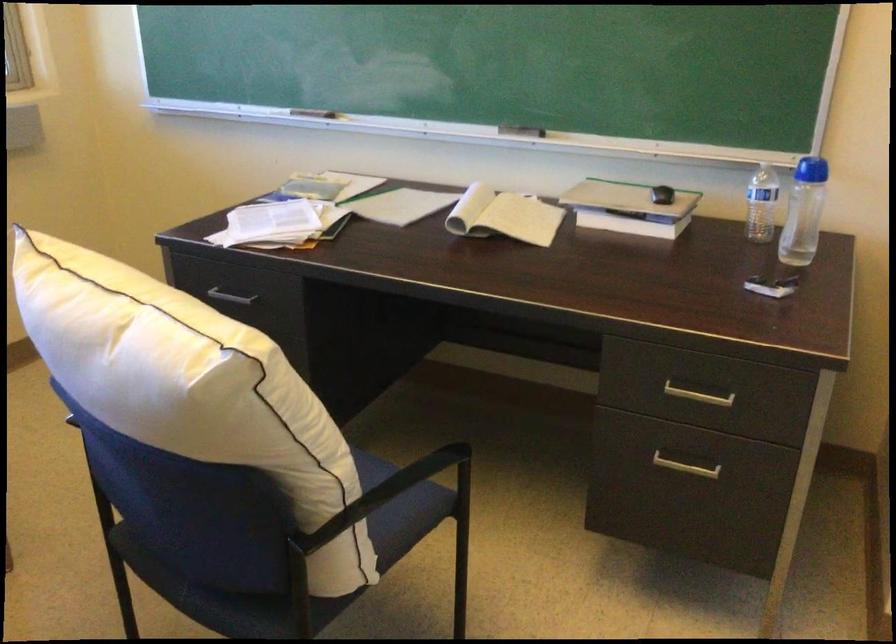
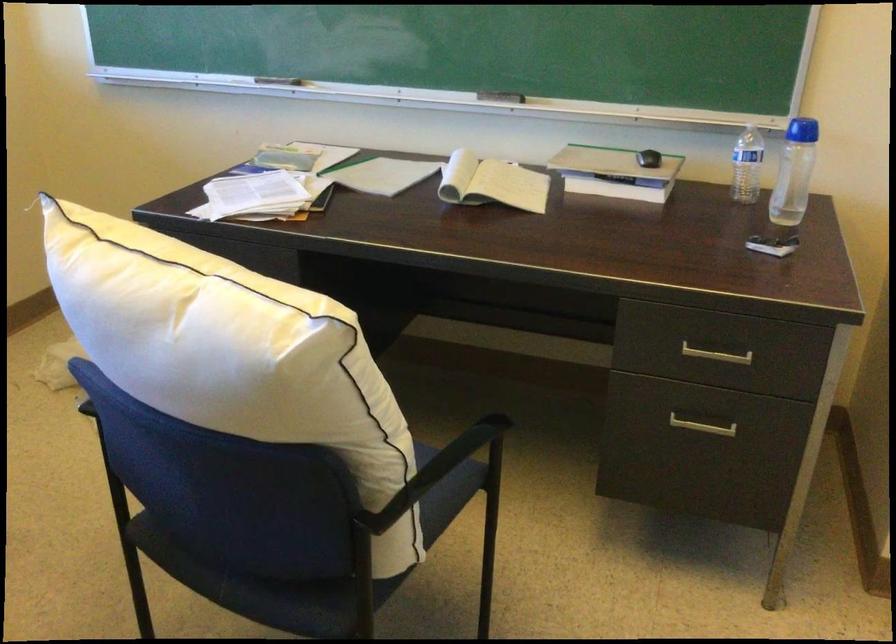
Where in the second image is the point corresponding to point (153, 381) from the first image?

(231, 353)